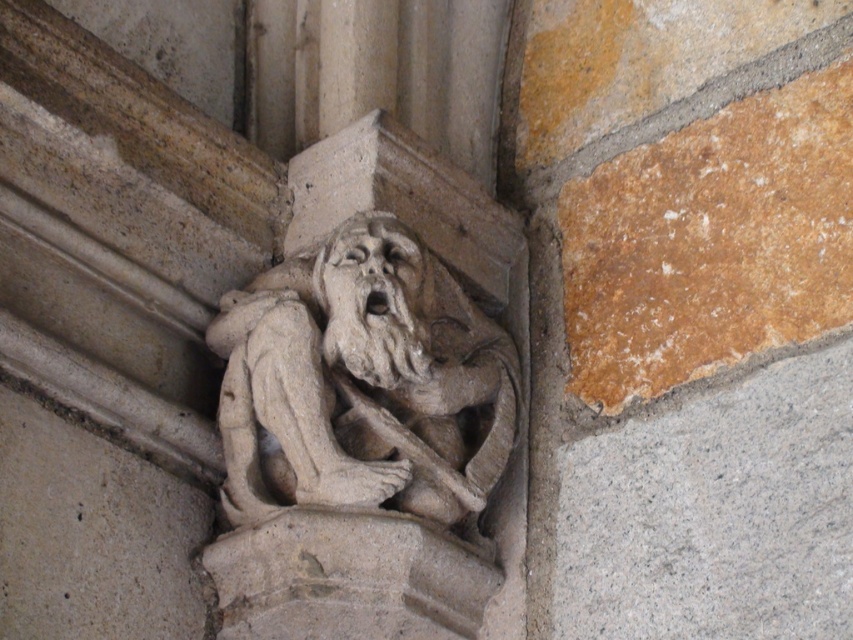
You are an architect examining the stone architectural detail. You notice the stone carved gargoyle at center and the gray stone face at center. Which of these two has a greater width?

The stone carved gargoyle at center has a greater width than the gray stone face at center.

You are an art restorer examining the stone architectural detail. You need to determine which object is larger between the stone carved gargoyle at center and the gray stone face at center. Which one is bigger?

The stone carved gargoyle at center is bigger than the gray stone face at center according to the description.

You are an architect examining the stone architectural detail. You notice the stone carved gargoyle at center and the gray stone face at center. Which object is positioned lower in the scene?

The stone carved gargoyle at center is positioned below the gray stone face at center, so it is lower in the scene.